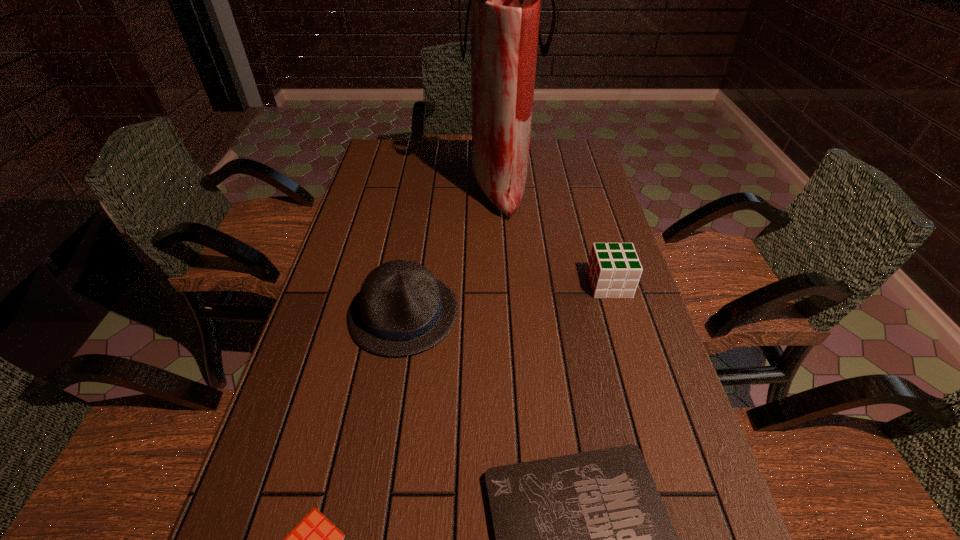
Where is `object that is at the left edge`? object that is at the left edge is located at coordinates (x=402, y=309).

You are a GUI agent. You are given a task and a screenshot of the screen. Output one action in this format:
    pyautogui.click(x=<x>, y=<y>)
    Task: Click on the object at the right edge
    The height and width of the screenshot is (540, 960).
    Given the screenshot: What is the action you would take?
    pyautogui.click(x=614, y=270)

What are the coordinates of `vacant space at the far edge of the desktop` in the screenshot? It's located at (529, 171).

Find the location of a particular element. vacant space at the left edge is located at coordinates (306, 484).

I want to click on blank area at the right edge, so click(x=603, y=189).

Find the location of a particular element. vacant space at the far left corner of the desktop is located at coordinates coord(409,145).

The width and height of the screenshot is (960, 540). In order to click on vacant region at the far right corner of the desktop in this screenshot , I will do `click(581, 153)`.

Find the location of a particular element. free space between the grocery bag and the fourth shortest object is located at coordinates (451, 250).

The height and width of the screenshot is (540, 960). Find the location of `free space between the fourth shortest object and the grocery bag`. free space between the fourth shortest object and the grocery bag is located at coordinates (451, 250).

What are the coordinates of `object that stands as the second closest to the grocery bag` in the screenshot? It's located at (614, 270).